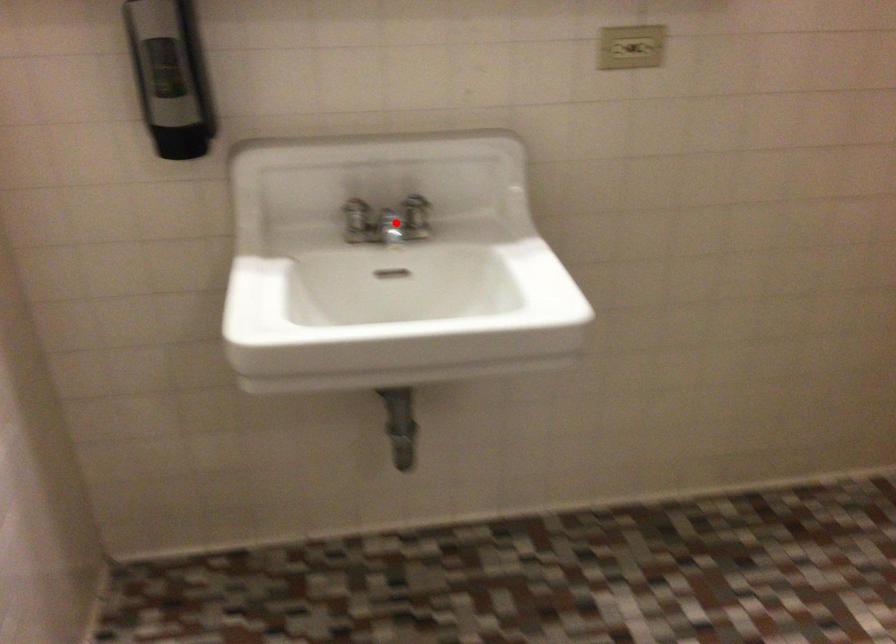
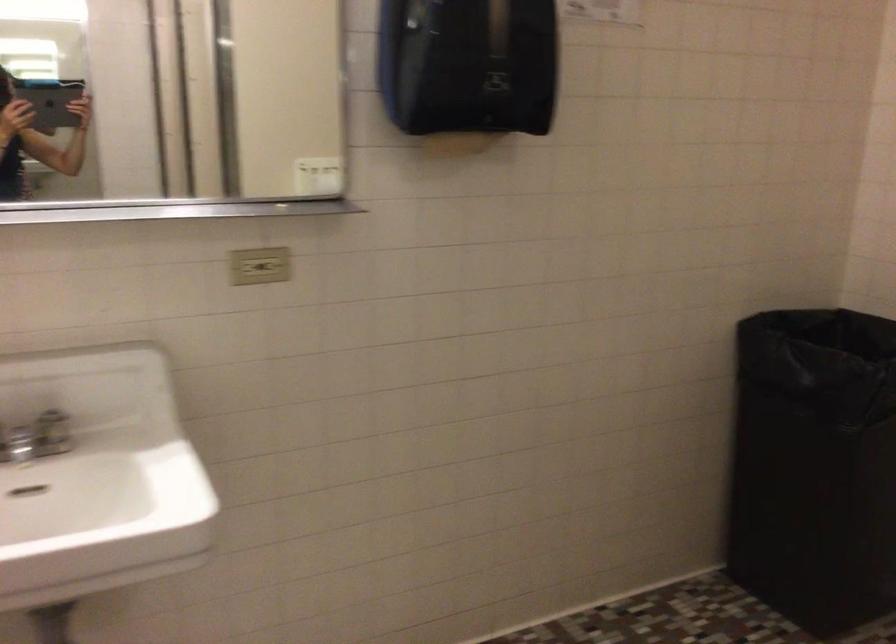
Find the pixel in the second image that matches the highlighted location in the first image.

(37, 438)